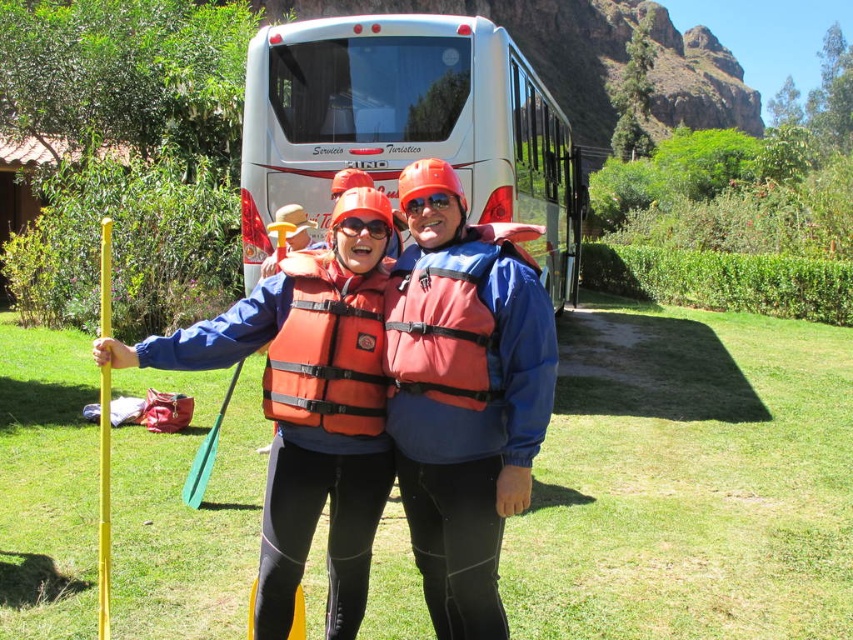
You are a safety inspector checking the gear of two people preparing for a water activity. Both are wearing orange life jackets. However, one is labeled as orange life jacket at center and the other as orange nylon life jacket at center. According to the scene description, which life jacket is taller?

The orange life jacket at center is taller than the orange nylon life jacket at center.